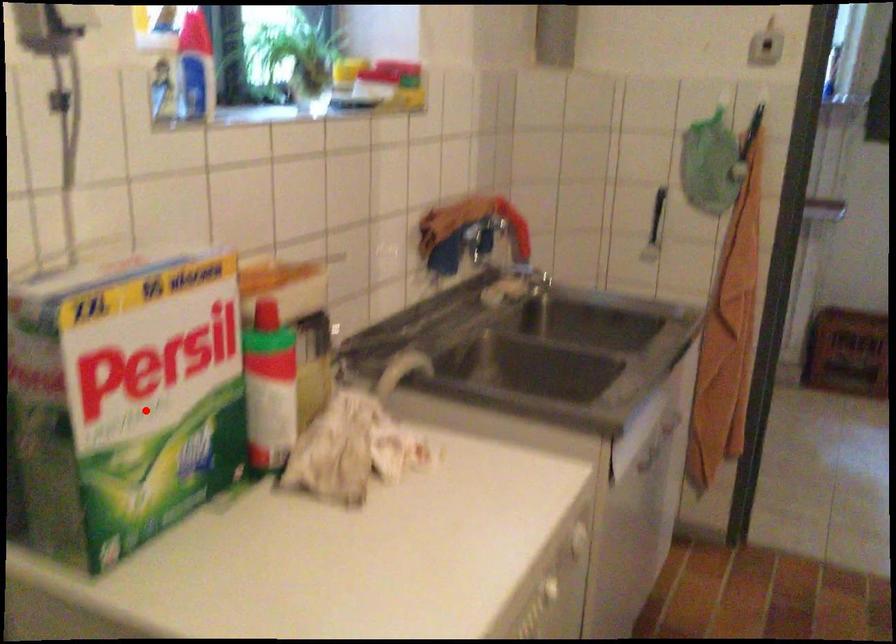
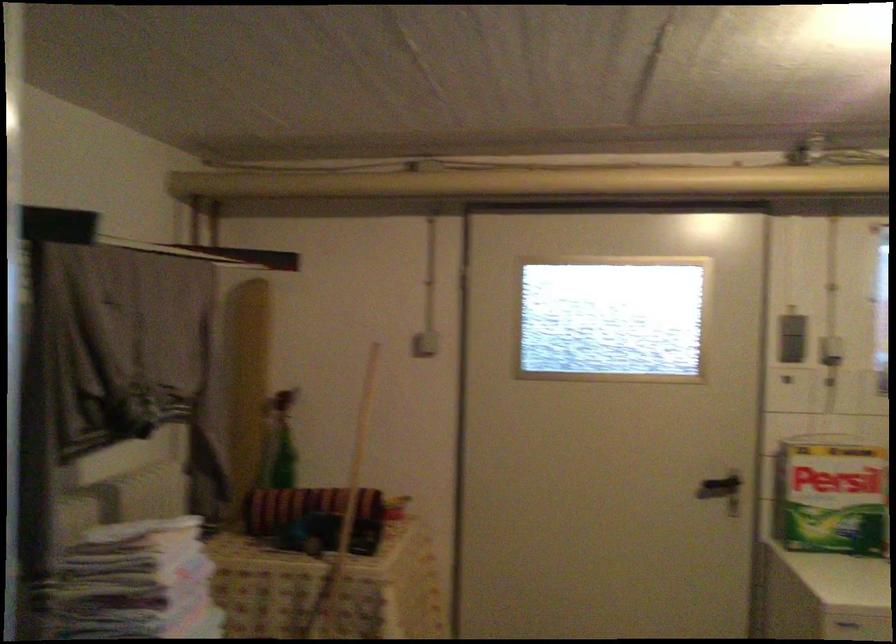
Find the pixel in the second image that matches the highlighted location in the first image.

(831, 496)